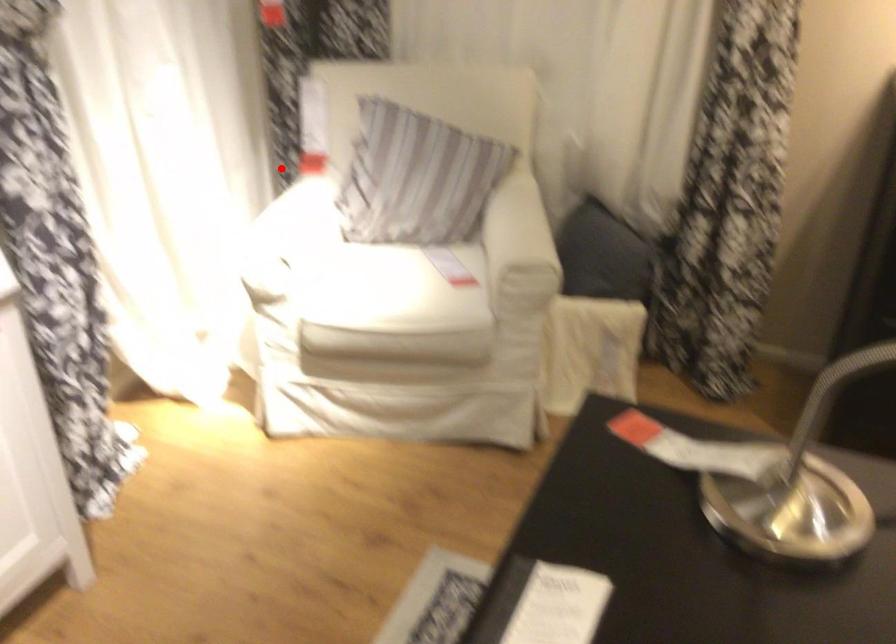
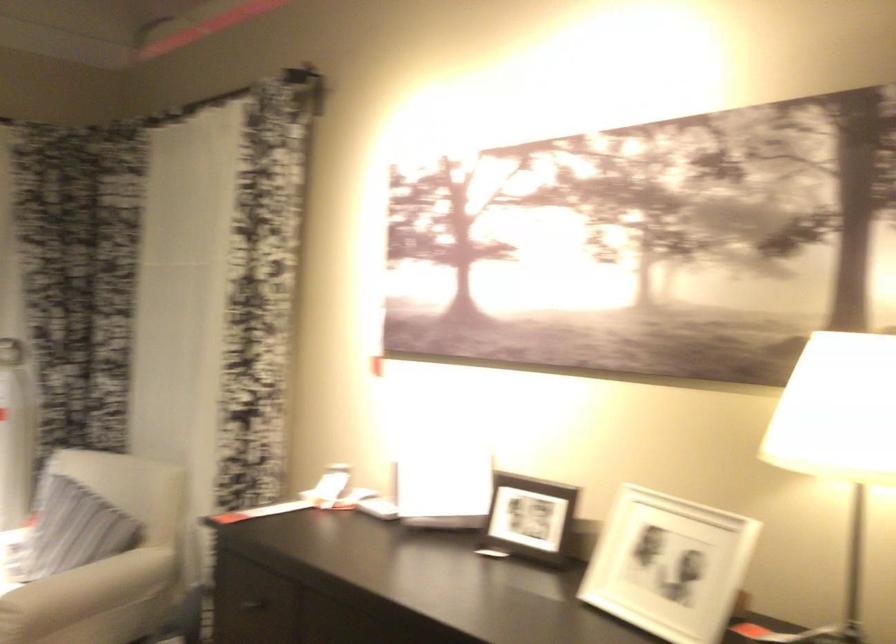
Find the pixel in the second image that matches the highlighted location in the first image.

(29, 513)